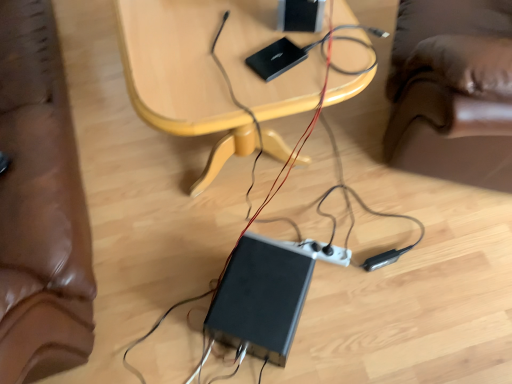
Question: Is black plastic computer at lower center with wooden table at center?

Choices:
 (A) yes
 (B) no

Answer: (B)

Question: Is black plastic computer at lower center to the left of wooden table at center from the viewer's perspective?

Choices:
 (A) yes
 (B) no

Answer: (B)

Question: From a real-world perspective, is black plastic computer at lower center below wooden table at center?

Choices:
 (A) yes
 (B) no

Answer: (A)

Question: Considering the relative sizes of black plastic computer at lower center and wooden table at center in the image provided, is black plastic computer at lower center thinner than wooden table at center?

Choices:
 (A) yes
 (B) no

Answer: (A)

Question: From a real-world perspective, is black plastic computer at lower center on wooden table at center?

Choices:
 (A) yes
 (B) no

Answer: (B)

Question: Considering the relative positions of black plastic computer at lower center and wooden table at center in the image provided, is black plastic computer at lower center in front of wooden table at center?

Choices:
 (A) no
 (B) yes

Answer: (A)

Question: From a real-world perspective, does wooden table at center sit lower than black plastic computer at lower center?

Choices:
 (A) no
 (B) yes

Answer: (A)

Question: Can you confirm if wooden table at center is taller than black plastic computer at lower center?

Choices:
 (A) no
 (B) yes

Answer: (B)

Question: From a real-world perspective, is wooden table at center on black plastic computer at lower center?

Choices:
 (A) yes
 (B) no

Answer: (A)

Question: Is wooden table at center positioned before black plastic computer at lower center?

Choices:
 (A) no
 (B) yes

Answer: (B)

Question: Would you say wooden table at center contains black plastic computer at lower center?

Choices:
 (A) yes
 (B) no

Answer: (B)

Question: Is there a large distance between wooden table at center and black plastic computer at lower center?

Choices:
 (A) no
 (B) yes

Answer: (A)

Question: From the image's perspective, relative to wooden table at center, is black plastic computer at lower center above or below?

Choices:
 (A) above
 (B) below

Answer: (B)